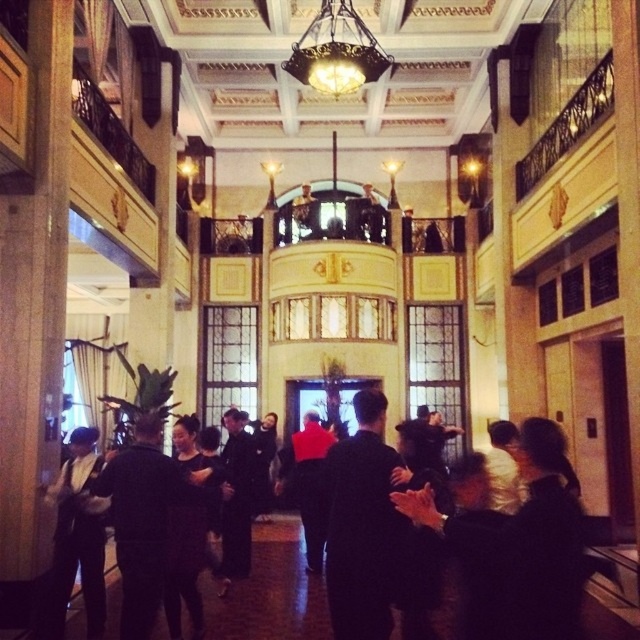
Question: Is black fabric coat at center positioned in front of red fabric jacket at center?

Choices:
 (A) yes
 (B) no

Answer: (B)

Question: Is black suit at left below red fabric jacket at center?

Choices:
 (A) yes
 (B) no

Answer: (B)

Question: Is black matte dress at center above gold textured chandelier at upper center?

Choices:
 (A) no
 (B) yes

Answer: (A)

Question: Which of the following is the farthest from the observer?

Choices:
 (A) (74, 515)
 (B) (442, 621)

Answer: (B)

Question: Which object is closer to the camera taking this photo?

Choices:
 (A) black suit at left
 (B) black fabric coat at center

Answer: (A)

Question: Which of the following is the closest to the observer?

Choices:
 (A) (72, 500)
 (B) (106, 589)
 (C) (332, 38)

Answer: (A)